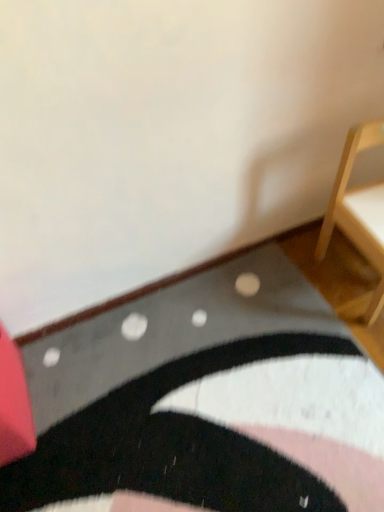
Question: Can you confirm if rubberized red cushion at lower left, which appears as the second furniture when viewed from the right, is bigger than light wood chair at right, which is the 1th furniture from right to left?

Choices:
 (A) no
 (B) yes

Answer: (A)

Question: Does rubberized red cushion at lower left, which appears as the second furniture when viewed from the right, have a greater width compared to light wood chair at right, which is the 1th furniture from right to left?

Choices:
 (A) no
 (B) yes

Answer: (B)

Question: Is rubberized red cushion at lower left, which is counted as the first furniture, starting from the left, not inside light wood chair at right, the 2th furniture when ordered from left to right?

Choices:
 (A) yes
 (B) no

Answer: (A)

Question: Is rubberized red cushion at lower left, which is counted as the first furniture, starting from the left, to the right of light wood chair at right, which is the 1th furniture from right to left, from the viewer's perspective?

Choices:
 (A) yes
 (B) no

Answer: (B)

Question: Does rubberized red cushion at lower left, which appears as the second furniture when viewed from the right, lie in front of light wood chair at right, the 2th furniture when ordered from left to right?

Choices:
 (A) no
 (B) yes

Answer: (B)

Question: Considering the relative sizes of rubberized red cushion at lower left, which is counted as the first furniture, starting from the left, and light wood chair at right, which is the 1th furniture from right to left, in the image provided, is rubberized red cushion at lower left, which is counted as the first furniture, starting from the left, smaller than light wood chair at right, which is the 1th furniture from right to left,?

Choices:
 (A) no
 (B) yes

Answer: (B)

Question: Does light wood chair at right, the 2th furniture when ordered from left to right, have a lesser height compared to black textured rug at lower center?

Choices:
 (A) no
 (B) yes

Answer: (A)

Question: Considering the relative sizes of light wood chair at right, the 2th furniture when ordered from left to right, and black textured rug at lower center in the image provided, is light wood chair at right, the 2th furniture when ordered from left to right, smaller than black textured rug at lower center?

Choices:
 (A) yes
 (B) no

Answer: (A)

Question: Is black textured rug at lower center inside light wood chair at right, which is the 1th furniture from right to left?

Choices:
 (A) yes
 (B) no

Answer: (B)

Question: Can you confirm if light wood chair at right, the 2th furniture when ordered from left to right, is taller than black textured rug at lower center?

Choices:
 (A) yes
 (B) no

Answer: (A)

Question: Can you confirm if light wood chair at right, which is the 1th furniture from right to left, is thinner than black textured rug at lower center?

Choices:
 (A) no
 (B) yes

Answer: (B)

Question: From the image's perspective, does light wood chair at right, which is the 1th furniture from right to left, appear higher than black textured rug at lower center?

Choices:
 (A) no
 (B) yes

Answer: (B)

Question: Considering the relative sizes of rubberized red cushion at lower left, which is counted as the first furniture, starting from the left, and black textured rug at lower center in the image provided, is rubberized red cushion at lower left, which is counted as the first furniture, starting from the left, wider than black textured rug at lower center?

Choices:
 (A) yes
 (B) no

Answer: (B)